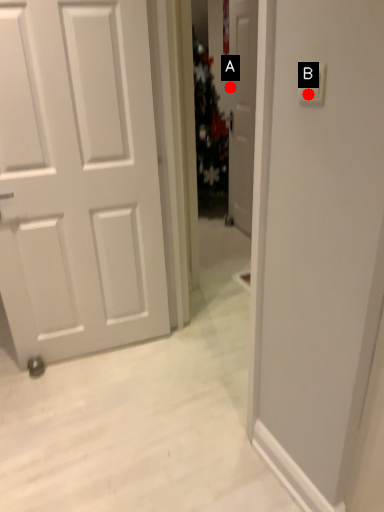
Question: Two points are circled on the image, labeled by A and B beside each circle. Which point is further to the camera?

Choices:
 (A) A is further
 (B) B is further

Answer: (A)